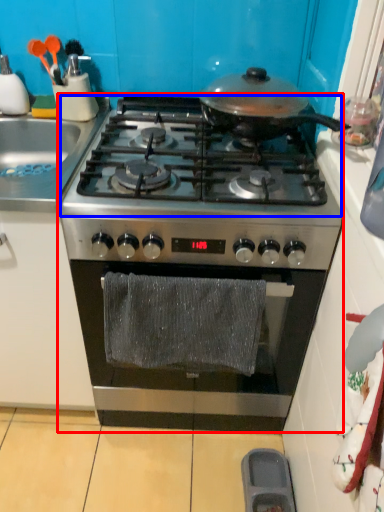
Question: Which point is further to the camera, gas stove (highlighted by a red box) or gas stove (highlighted by a blue box)?

Choices:
 (A) gas stove
 (B) gas stove

Answer: (A)